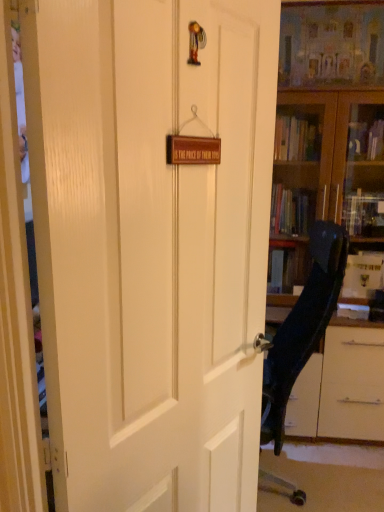
This screenshot has width=384, height=512. Describe the element at coordinates (326, 188) in the screenshot. I see `wooden bookcase at right` at that location.

Describe the element at coordinates (155, 249) in the screenshot. I see `white matte door at center` at that location.

The height and width of the screenshot is (512, 384). Find the location of `wooden bookcase at right`. wooden bookcase at right is located at coordinates (326, 188).

Looking at this image, between wooden book at center and white matte door at center, which one has smaller size?

wooden book at center is smaller.

Does wooden book at center lie in front of white matte door at center?

No.

At what (x,y) coordinates should I click in order to perform the action: click on book behind the white matte door at center. Please return your answer as a coordinate pair (x, y). The image size is (384, 512). Looking at the image, I should click on (353, 311).

In the scene shown: How different are the orientations of wooden book at center and white matte door at center in degrees?

65 degrees separate the facing orientations of wooden book at center and white matte door at center.

Does point (92, 169) lie behind point (301, 314)?

No, (92, 169) is in front of (301, 314).

From the image's perspective, between white matte door at center and black plastic chair at right, who is located below?

black plastic chair at right is shown below in the image.

Choose the correct answer: Is white matte door at center inside black plastic chair at right or outside it?

white matte door at center cannot be found inside black plastic chair at right.

In the scene shown: How different are the orientations of white matte door at center and black plastic chair at right in degrees?

They differ by 147 degrees in their facing directions.

Is black plastic chair at right positioned with its back to wooden book at center?

No, black plastic chair at right is not facing away from wooden book at center.

Looking at this image, which of these two, black plastic chair at right or wooden book at center, stands shorter?

Standing shorter between the two is wooden book at center.

How different are the orientations of black plastic chair at right and wooden book at center in degrees?

81.9 degrees separate the facing orientations of black plastic chair at right and wooden book at center.

Identify the location of chair below the wooden book at center (from a real-world perspective). The height and width of the screenshot is (512, 384). (302, 327).

Does white matte door at center have a larger size compared to wooden book at center?

Yes, white matte door at center is bigger than wooden book at center.

Considering the sizes of objects white matte door at center and wooden book at center in the image provided, who is shorter, white matte door at center or wooden book at center?

wooden book at center is shorter.

Between white matte door at center and wooden book at center, which one has smaller width?

Thinner between the two is white matte door at center.

Is white matte door at center completely or partially outside of wooden book at center?

white matte door at center lies outside wooden book at center's area.

Which is more to the right, wooden book at center or wooden bookcase at right?

wooden book at center.

From a real-world perspective, is wooden book at center physically located above or below wooden bookcase at right?

Clearly, from a real-world perspective, wooden book at center is below wooden bookcase at right.

The height and width of the screenshot is (512, 384). I want to click on bookcase in front of the wooden book at center, so click(x=326, y=188).

Which object is more forward, wooden book at center or wooden bookcase at right?

wooden bookcase at right is more forward.

Is wooden bookcase at right situated inside black plastic chair at right or outside?

wooden bookcase at right is not enclosed by black plastic chair at right.

Consider the image. In the image, is wooden bookcase at right positioned in front of or behind black plastic chair at right?

Clearly, wooden bookcase at right is behind black plastic chair at right.

Can you confirm if wooden bookcase at right is positioned to the right of black plastic chair at right?

Correct, you'll find wooden bookcase at right to the right of black plastic chair at right.

From a real-world perspective, which is physically above, wooden bookcase at right or black plastic chair at right?

In real-world perspective, wooden bookcase at right is above.

Is black plastic chair at right further to the viewer compared to wooden bookcase at right?

No, black plastic chair at right is closer to the viewer.

In terms of width, does black plastic chair at right look wider or thinner when compared to wooden bookcase at right?

Considering their sizes, black plastic chair at right looks slimmer than wooden bookcase at right.

From the image's perspective, which one is positioned higher, black plastic chair at right or wooden bookcase at right?

From the image's view, wooden bookcase at right is above.

How many degrees apart are the facing directions of black plastic chair at right and wooden bookcase at right?

There is a 89.3-degree angle between the facing directions of black plastic chair at right and wooden bookcase at right.

The height and width of the screenshot is (512, 384). Find the location of `book on the right of white matte door at center`. book on the right of white matte door at center is located at coordinates (353, 311).

The image size is (384, 512). I want to click on door that is in front of the black plastic chair at right, so click(155, 249).

Which object lies nearer to the anchor point black plastic chair at right, wooden bookcase at right or wooden book at center?

wooden bookcase at right is closer to black plastic chair at right.

From the picture: Considering their positions, is white matte door at center positioned closer to wooden bookcase at right than black plastic chair at right?

black plastic chair at right is positioned closer to the anchor wooden bookcase at right.

Considering their positions, is wooden book at center positioned closer to black plastic chair at right than wooden bookcase at right?

wooden bookcase at right is closer to black plastic chair at right.

Looking at this image, considering their positions, is wooden bookcase at right positioned closer to white matte door at center than wooden book at center?

Answer: Based on the image, wooden bookcase at right appears to be nearer to white matte door at center.

Looking at the image, which one is located closer to white matte door at center, wooden book at center or wooden bookcase at right?

wooden bookcase at right.

Looking at the image, which one is located closer to white matte door at center, wooden book at center or black plastic chair at right?

Based on the image, black plastic chair at right appears to be nearer to white matte door at center.

Based on their spatial positions, is wooden book at center or white matte door at center further from wooden bookcase at right?

white matte door at center.

Which object lies further to the anchor point wooden book at center, black plastic chair at right or wooden bookcase at right?

wooden bookcase at right is further to wooden book at center.

Image resolution: width=384 pixels, height=512 pixels. Find the location of `bookcase between white matte door at center and wooden book at center along the z-axis`. bookcase between white matte door at center and wooden book at center along the z-axis is located at coordinates (326, 188).

Image resolution: width=384 pixels, height=512 pixels. I want to click on chair between white matte door at center and wooden bookcase at right from front to back, so click(302, 327).

Where is `chair positioned between white matte door at center and wooden book at center from near to far`? The width and height of the screenshot is (384, 512). chair positioned between white matte door at center and wooden book at center from near to far is located at coordinates (302, 327).

Find the location of a particular element. bookcase positioned between black plastic chair at right and wooden book at center from near to far is located at coordinates (326, 188).